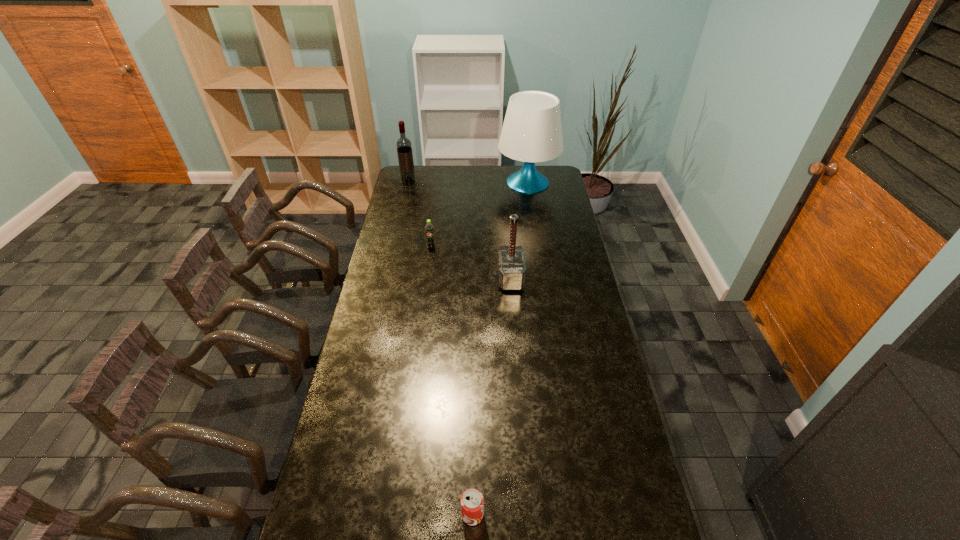
Identify the location of blank space located on the front of the leftmost object. (402, 210).

The image size is (960, 540). Identify the location of vacant space located on the back of the hammer. (x=509, y=257).

This screenshot has width=960, height=540. Find the location of `free location located on the front label of the third farthest object`. free location located on the front label of the third farthest object is located at coordinates (422, 313).

This screenshot has height=540, width=960. Identify the location of blank space located 0.310m on the left of the nearest object. (348, 515).

Where is `table lamp that is at the far edge`? This screenshot has width=960, height=540. table lamp that is at the far edge is located at coordinates (532, 131).

This screenshot has height=540, width=960. What are the coordinates of `wine bottle that is at the far edge` in the screenshot? It's located at (404, 147).

Where is `object at the left edge`? object at the left edge is located at coordinates [404, 147].

Where is `object located at the right edge`? object located at the right edge is located at coordinates (532, 131).

At what (x,y) coordinates should I click in order to perform the action: click on object situated at the far left corner. Please return your answer as a coordinate pair (x, y). The height and width of the screenshot is (540, 960). Looking at the image, I should click on (404, 147).

You are a GUI agent. You are given a task and a screenshot of the screen. Output one action in this format:
    pyautogui.click(x=<x>, y=<y>)
    Task: Click on the object positioned at the far right corner
    Image resolution: width=960 pixels, height=540 pixels.
    Given the screenshot: What is the action you would take?
    pyautogui.click(x=532, y=131)